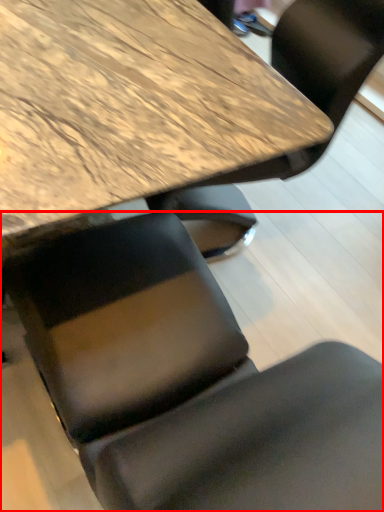
Question: From the image's perspective, considering the relative positions of chair (annotated by the red box) and table in the image provided, where is chair (annotated by the red box) located with respect to the staircase?

Choices:
 (A) below
 (B) above

Answer: (A)